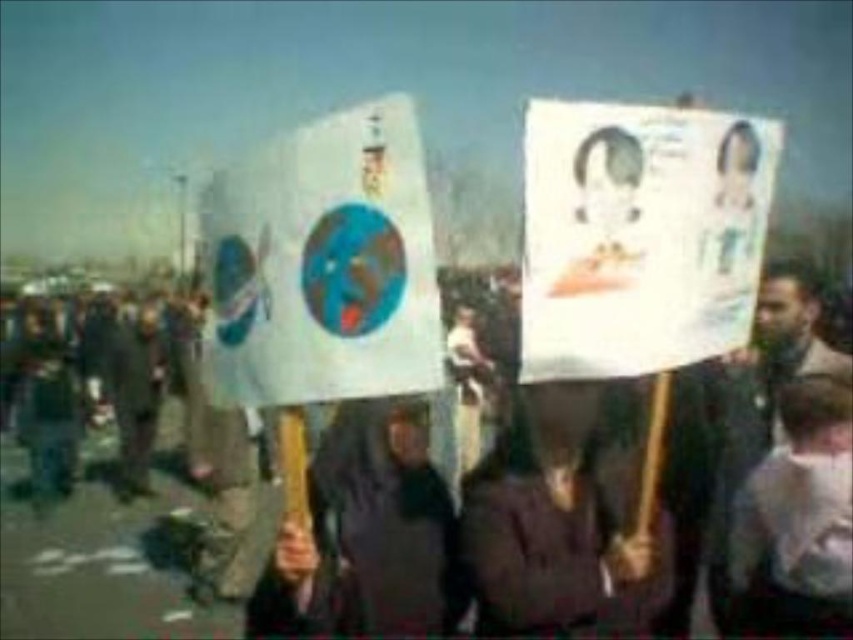
Question: Among these points, which one is farthest from the camera?

Choices:
 (A) (326, 120)
 (B) (643, 253)
 (C) (474, 620)

Answer: (C)

Question: Which of the following is the closest to the observer?

Choices:
 (A) (821, 374)
 (B) (715, 195)
 (C) (227, 288)

Answer: (C)

Question: Observing the image, what is the correct spatial positioning of white cardboard poster at center in reference to white cotton shirt at center?

Choices:
 (A) above
 (B) below

Answer: (A)

Question: Does white paper poster at upper center lie in front of white cotton shirt at center?

Choices:
 (A) no
 (B) yes

Answer: (B)

Question: Which object is closer to the camera taking this photo?

Choices:
 (A) white paper poster at upper center
 (B) white cardboard poster at center
 (C) dark brown fabric at center
 (D) white cotton shirt at center

Answer: (B)

Question: Is white cardboard poster at center smaller than dark brown fabric at center?

Choices:
 (A) no
 (B) yes

Answer: (B)